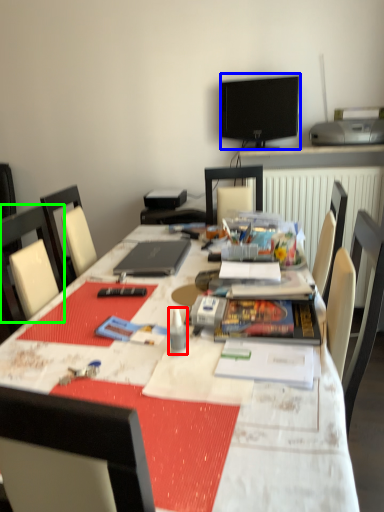
Question: Which object is the farthest from stationery (highlighted by a red box)? Choose among these: television (highlighted by a blue box) or chair (highlighted by a green box).

Choices:
 (A) television
 (B) chair

Answer: (A)